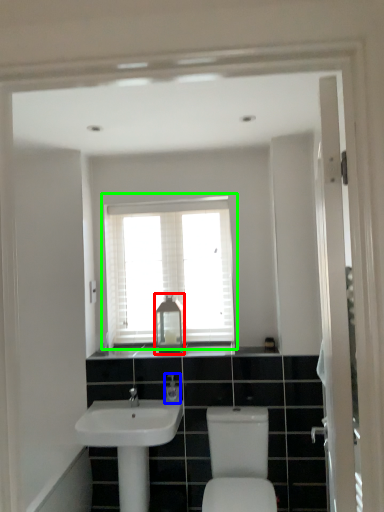
Question: Estimate the real-world distances between objects in this image. Which object is farther from medicine cabinet (highlighted by a red box), toiletry (highlighted by a blue box) or window (highlighted by a green box)?

Choices:
 (A) toiletry
 (B) window

Answer: (A)